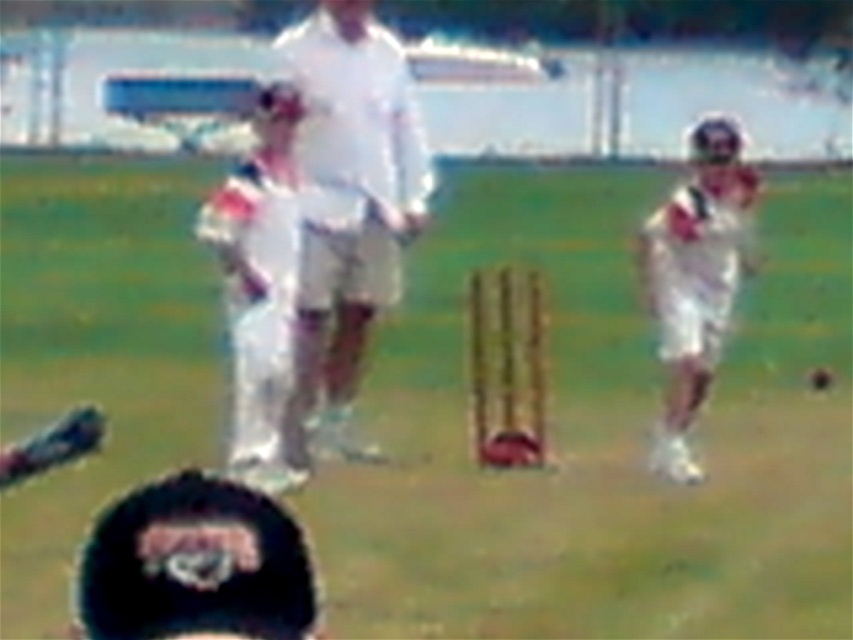
Who is higher up, white cloth cricket bat at center or white matte uniform at center?

white matte uniform at center is higher up.

Does white cloth cricket bat at center have a lesser width compared to white matte uniform at center?

Indeed, white cloth cricket bat at center has a lesser width compared to white matte uniform at center.

Locate an element on the screen. Image resolution: width=853 pixels, height=640 pixels. white cloth cricket bat at center is located at coordinates (347, 209).

Based on the photo, does white cloth cricket bat at center have a larger size compared to black fabric cap at lower left?

Actually, white cloth cricket bat at center might be smaller than black fabric cap at lower left.

Where is `white cloth cricket bat at center`? white cloth cricket bat at center is located at coordinates (347, 209).

Who is shorter, black fabric cap at lower left or white matte uniform at center?

black fabric cap at lower left

Is point (219, 616) positioned after point (718, 262)?

No, (219, 616) is in front of (718, 262).

Where is `black fabric cap at lower left`? The height and width of the screenshot is (640, 853). black fabric cap at lower left is located at coordinates coord(196,564).